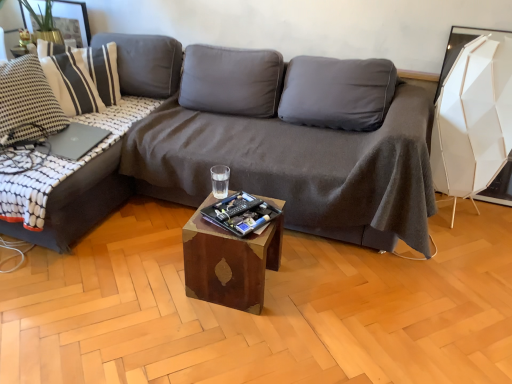
Question: Is dark gray fabric couch at left, the 2th studio couch when ordered from right to left, bigger than wooden cube at center?

Choices:
 (A) yes
 (B) no

Answer: (A)

Question: From the image's perspective, is dark gray fabric couch at left, the 2th studio couch when ordered from right to left, beneath wooden cube at center?

Choices:
 (A) yes
 (B) no

Answer: (B)

Question: Does dark gray fabric couch at left, the 2th studio couch when ordered from right to left, lie in front of wooden cube at center?

Choices:
 (A) no
 (B) yes

Answer: (B)

Question: Considering the relative positions of dark gray fabric couch at left, the 2th studio couch when ordered from right to left, and wooden cube at center in the image provided, is dark gray fabric couch at left, the 2th studio couch when ordered from right to left, to the right of wooden cube at center from the viewer's perspective?

Choices:
 (A) yes
 (B) no

Answer: (B)

Question: Could you tell me if dark gray fabric couch at left, arranged as the first studio couch when viewed from the left, is turned towards wooden cube at center?

Choices:
 (A) yes
 (B) no

Answer: (A)

Question: Is dark gray fabric couch at center, placed as the 1th studio couch when sorted from right to left, spatially inside white textured pillow at upper left, or outside of it?

Choices:
 (A) inside
 (B) outside

Answer: (B)

Question: Is dark gray fabric couch at center, placed as the 1th studio couch when sorted from right to left, bigger or smaller than white textured pillow at upper left?

Choices:
 (A) big
 (B) small

Answer: (A)

Question: In terms of height, does dark gray fabric couch at center, placed as the 1th studio couch when sorted from right to left, look taller or shorter compared to white textured pillow at upper left?

Choices:
 (A) short
 (B) tall

Answer: (B)

Question: From the image's perspective, is dark gray fabric couch at center, placed as the 1th studio couch when sorted from right to left, positioned above or below white textured pillow at upper left?

Choices:
 (A) above
 (B) below

Answer: (B)

Question: Visually, is white textured pillow at upper left positioned to the left or to the right of wooden cube at center?

Choices:
 (A) right
 (B) left

Answer: (B)

Question: Is white textured pillow at upper left inside or outside of wooden cube at center?

Choices:
 (A) outside
 (B) inside

Answer: (A)

Question: From a real-world perspective, is white textured pillow at upper left above or below wooden cube at center?

Choices:
 (A) above
 (B) below

Answer: (A)

Question: Considering the positions of white textured pillow at upper left and wooden cube at center in the image, is white textured pillow at upper left bigger or smaller than wooden cube at center?

Choices:
 (A) big
 (B) small

Answer: (A)

Question: From the image's perspective, is dark gray fabric couch at left, arranged as the first studio couch when viewed from the left, above or below wooden cube at center?

Choices:
 (A) below
 (B) above

Answer: (B)

Question: Considering the positions of dark gray fabric couch at left, the 2th studio couch when ordered from right to left, and wooden cube at center in the image, is dark gray fabric couch at left, the 2th studio couch when ordered from right to left, taller or shorter than wooden cube at center?

Choices:
 (A) short
 (B) tall

Answer: (B)